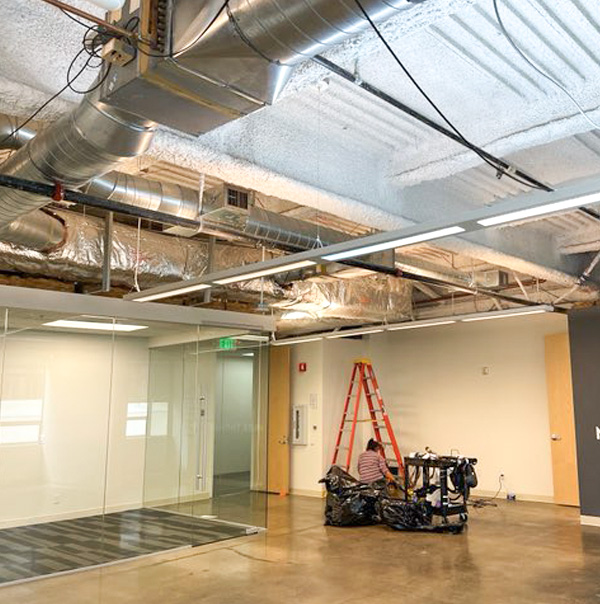
The image size is (600, 604). I want to click on doorknob, so click(200, 458).